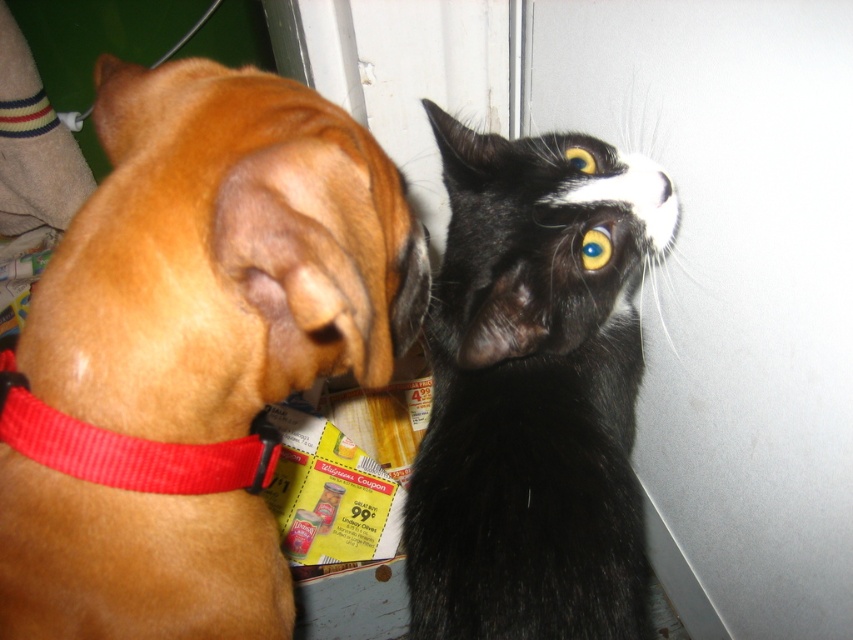
Question: Does brown fur dog at left appear under black silky fur cat at upper right?

Choices:
 (A) yes
 (B) no

Answer: (B)

Question: Can you confirm if brown fur dog at left is positioned below red fabric collar at left?

Choices:
 (A) yes
 (B) no

Answer: (B)

Question: Among these points, which one is nearest to the camera?

Choices:
 (A) (85, 465)
 (B) (312, 268)
 (C) (537, 490)

Answer: (B)

Question: Which point is closer to the camera taking this photo?

Choices:
 (A) (494, 337)
 (B) (167, 109)

Answer: (B)

Question: Can you confirm if black silky fur cat at upper right is positioned above red fabric collar at left?

Choices:
 (A) no
 (B) yes

Answer: (A)

Question: Considering the real-world distances, which object is closest to the black silky fur cat at upper right?

Choices:
 (A) red fabric collar at left
 (B) brown fur dog at left

Answer: (B)